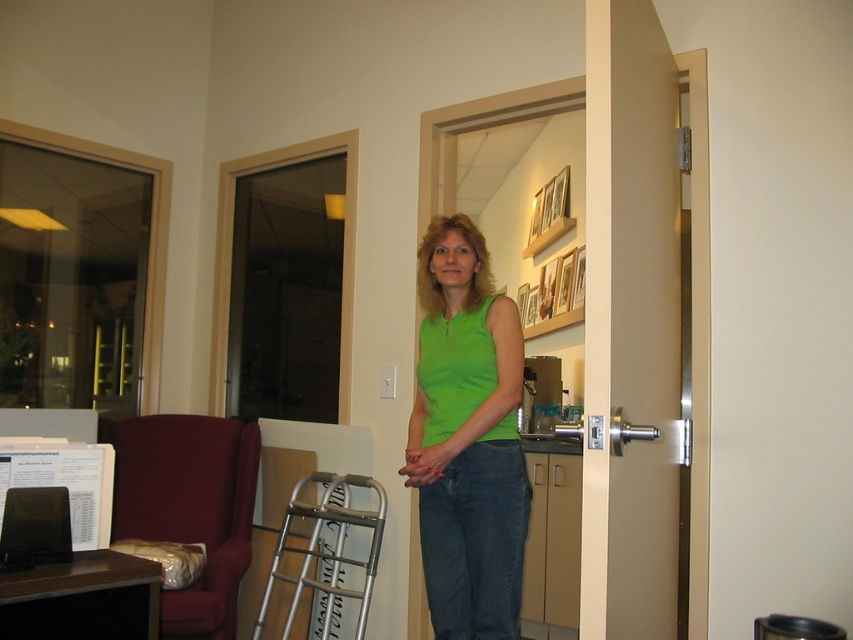
You are a person using the silver metallic walker at lower center and want to move to the velvet red armchair at left. Can you reach it without moving the walker?

The velvet red armchair at left and silver metallic walker at lower center are 13.39 inches apart from each other. Since the distance between them is less than the typical reach distance of a person using a walker, you can likely reach the velvet red armchair at left without moving the silver metallic walker at lower center.

You are a physical therapist helping a patient who needs to sit down. You see the velvet red armchair at left and the silver metallic walker at lower center. Which object should the patient use to sit down safely?

The patient should use the velvet red armchair at left because it has a larger size compared to the silver metallic walker at lower center, making it more stable for sitting.